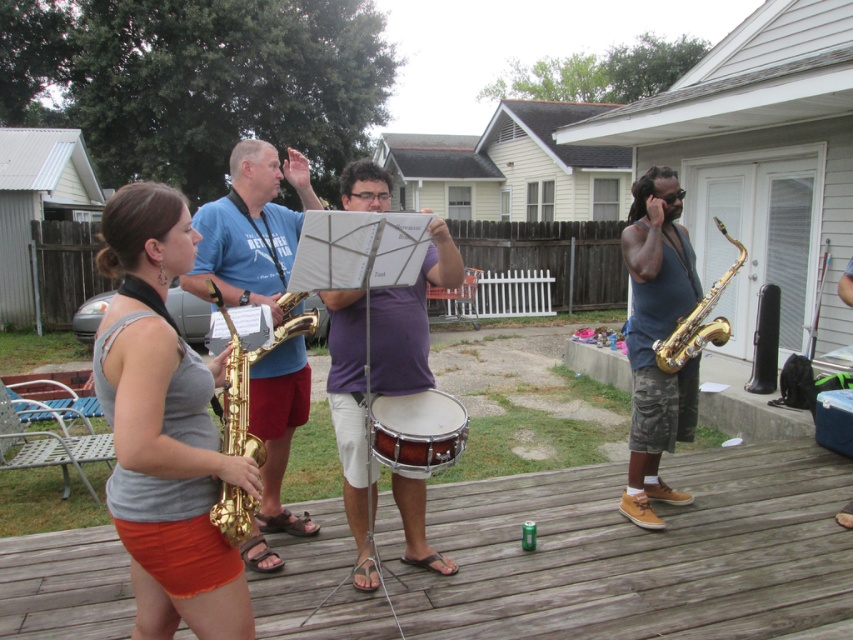
Question: Can you confirm if wooden deck at lower center is positioned above gold shiny saxophone at center?

Choices:
 (A) no
 (B) yes

Answer: (A)

Question: Estimate the real-world distances between objects in this image. Which object is closer to the mahogany wood snare drum at center?

Choices:
 (A) matte gray tank top at center
 (B) gold shiny saxophone at center
 (C) wooden deck at lower center

Answer: (B)

Question: Which object is positioned farthest from the camouflage shorts at right?

Choices:
 (A) gold saxophone at center
 (B) gold shiny saxophone at center
 (C) gold shiny saxophone at right
 (D) matte gray tank top at center

Answer: (D)

Question: Can you confirm if gold shiny saxophone at center is smaller than gold shiny saxophone at right?

Choices:
 (A) yes
 (B) no

Answer: (A)

Question: Does matte gray tank top at center have a greater width compared to gold shiny saxophone at center?

Choices:
 (A) yes
 (B) no

Answer: (A)

Question: Which is nearer to the matte gray tank top at center?

Choices:
 (A) wooden deck at lower center
 (B) gold shiny saxophone at right
 (C) mahogany wood snare drum at center
 (D) camouflage shorts at right

Answer: (C)